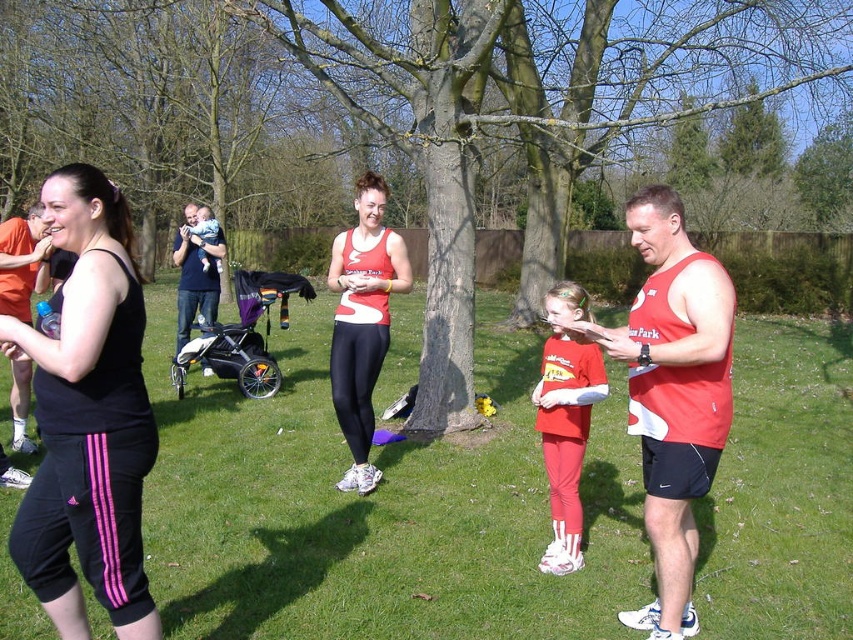
Describe the element at coordinates (20, 260) in the screenshot. I see `matte black tank top at left` at that location.

Who is lower down, matte black tank top at left or dark blue t-shirt at upper left?

matte black tank top at left

Measure the distance between point (21, 227) and camera.

They are 5.86 meters apart.

Locate an element on the screen. Image resolution: width=853 pixels, height=640 pixels. matte black tank top at left is located at coordinates (20, 260).

In the scene shown: Can you confirm if green grass at center is positioned below soft white baby at center?

Yes, green grass at center is below soft white baby at center.

Locate an element on the screen. green grass at center is located at coordinates (376, 508).

Between point (402, 529) and point (194, 220), which one is positioned behind?

Positioned behind is point (194, 220).

Image resolution: width=853 pixels, height=640 pixels. I want to click on green grass at center, so click(x=376, y=508).

Which is more to the right, red sleeveless shirt at center or soft white baby at center?

Positioned to the right is red sleeveless shirt at center.

Does red sleeveless shirt at center have a lesser height compared to soft white baby at center?

In fact, red sleeveless shirt at center may be taller than soft white baby at center.

Where is `red sleeveless shirt at center`? The width and height of the screenshot is (853, 640). red sleeveless shirt at center is located at coordinates (672, 394).